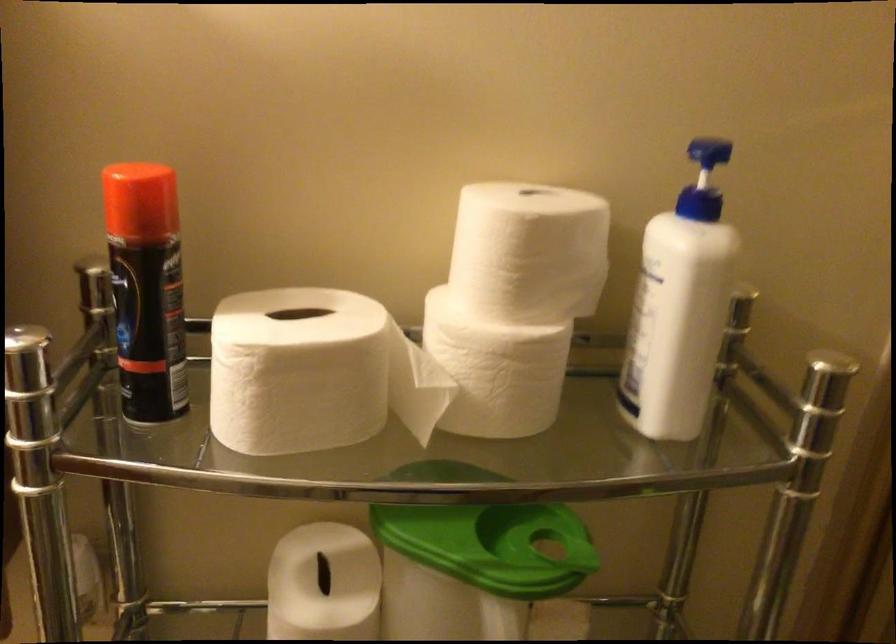
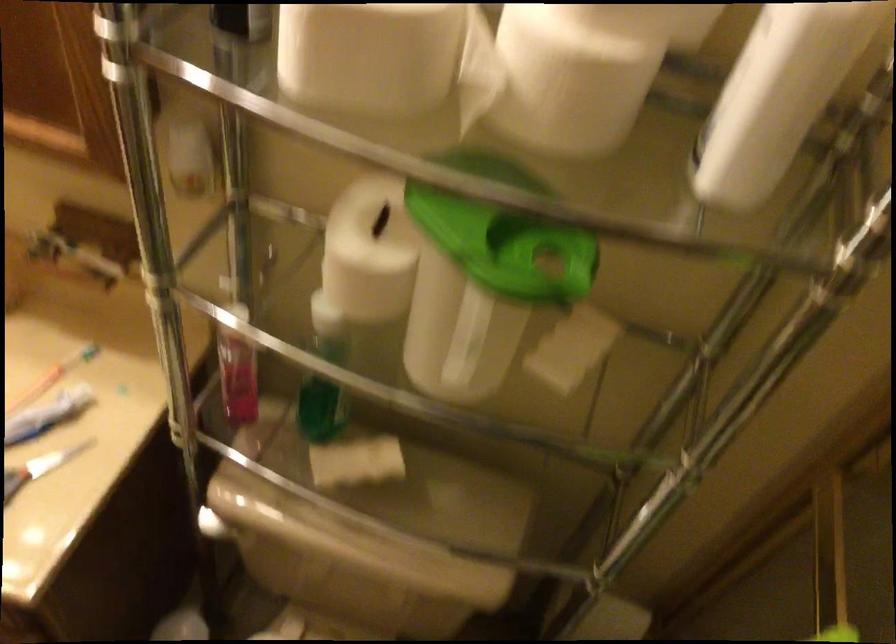
In the second image, find the point that corresponds to point 694,333 in the first image.

(778, 96)